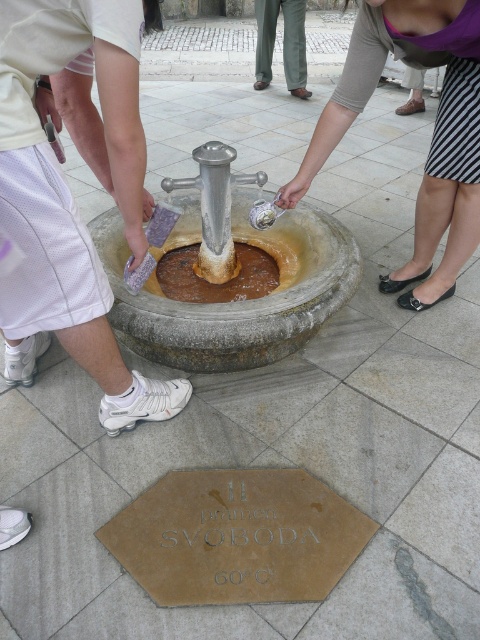
Describe the element at coordinates (216, 284) in the screenshot. I see `brown stone fountain at center` at that location.

Can you confirm if brown stone fountain at center is positioned above green fabric pants at center?

No.

At what (x,y) coordinates should I click in order to perform the action: click on brown stone fountain at center. Please return your answer as a coordinate pair (x, y). Looking at the image, I should click on (216, 284).

Is matte stone fountain at center shorter than striped skirt at lower right?

Yes, matte stone fountain at center is shorter than striped skirt at lower right.

Locate an element on the screen. This screenshot has height=640, width=480. matte stone fountain at center is located at coordinates (231, 301).

The image size is (480, 640). What are the coordinates of `matte stone fountain at center` in the screenshot? It's located at (231, 301).

Does matte stone fountain at center appear under brown stone fountain at center?

No.

Is matte stone fountain at center positioned in front of brown stone fountain at center?

Yes.

Find the location of a particular element. matte stone fountain at center is located at coordinates [x=231, y=301].